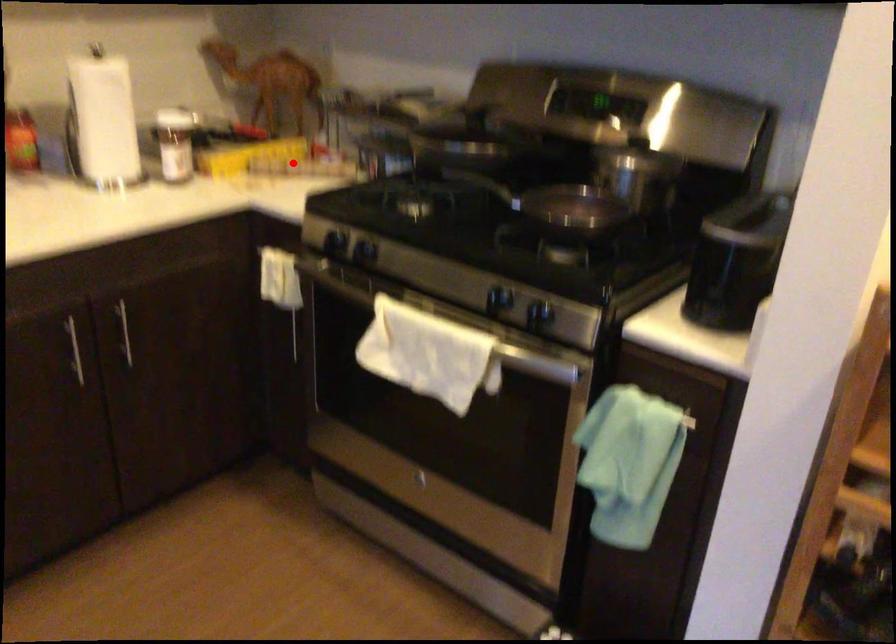
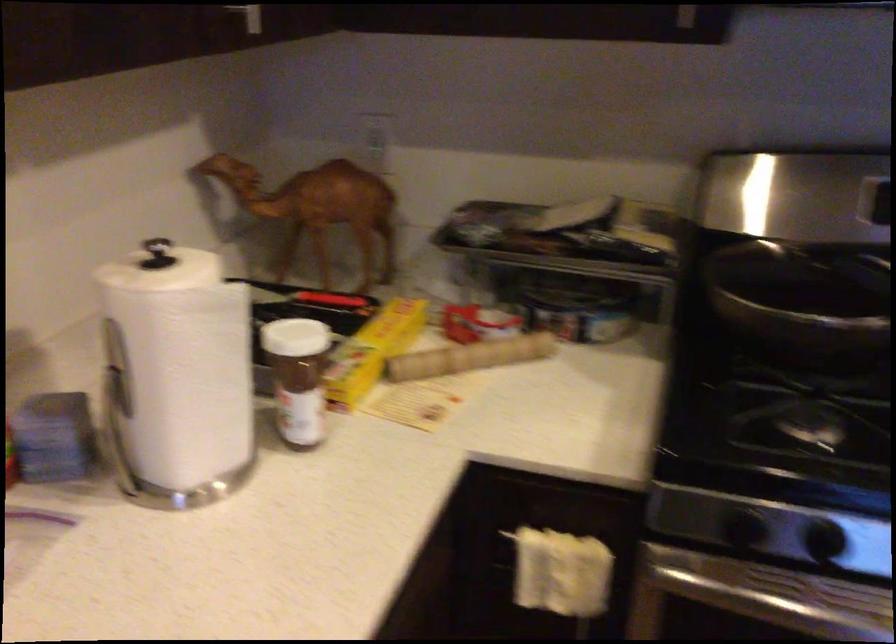
The point at the highlighted location is marked in the first image. Where is the corresponding point in the second image?

(469, 357)